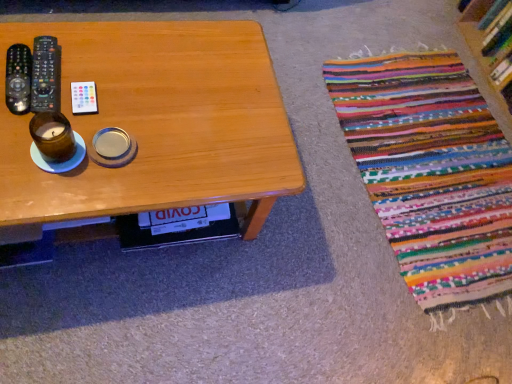
The height and width of the screenshot is (384, 512). Identify the location of vacant area on the back side of black plastic remote at left, the 2th remote control in the right-to-left sequence. (89, 44).